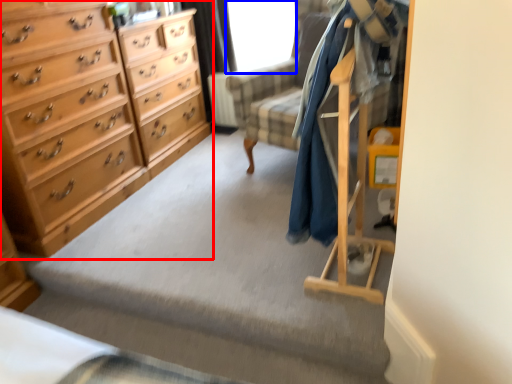
Question: Which of the following is the farthest to the observer, chest of drawers (highlighted by a red box) or window screen (highlighted by a blue box)?

Choices:
 (A) chest of drawers
 (B) window screen

Answer: (B)